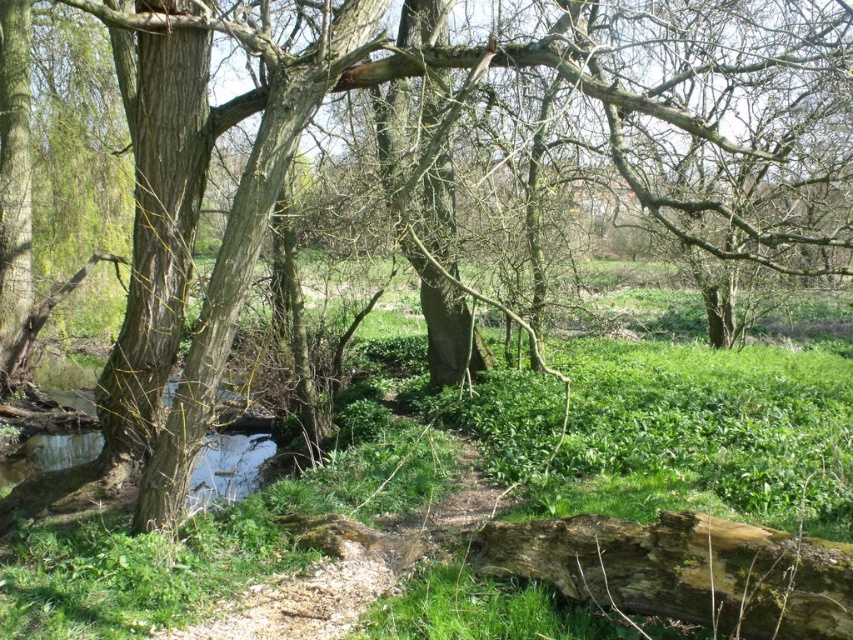
From the picture: You are a hiker who wants to cross the stream using the fallen tree trunk. You see the green leafy grass at center and the smooth bark tree trunk at left. Which object is closer to the stream?

The green leafy grass at center is located below the smooth bark tree trunk at left, meaning the grass is closer to the stream.

You are a hiker trying to cross the stream in the scene. You see the green leafy grass at center and the smooth bark tree trunk at left. Which surface would provide a more stable footing for crossing the stream?

The smooth bark tree trunk at left would provide a more stable footing for crossing the stream because it is larger in size than the green leafy grass at center.